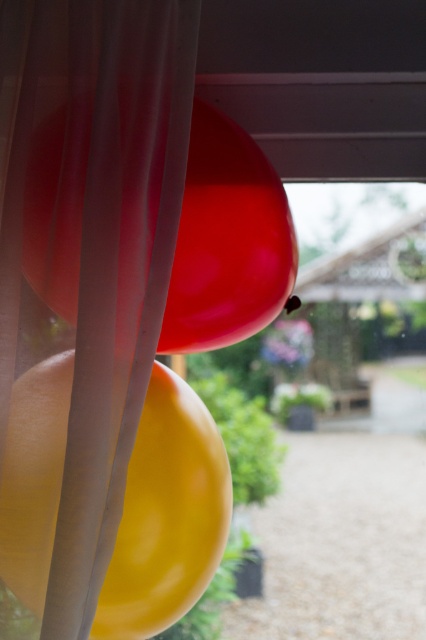
Question: Is translucent sheer curtain at left thinner than glossy rubber balloon at center?

Choices:
 (A) no
 (B) yes

Answer: (B)

Question: Estimate the real-world distances between objects in this image. Which object is farther from the glossy yellow balloon at center?

Choices:
 (A) translucent sheer curtain at left
 (B) glossy rubber balloon at center

Answer: (B)

Question: Which of the following is the closest to the observer?

Choices:
 (A) (77, 342)
 (B) (83, 145)
 (C) (166, 401)

Answer: (A)

Question: Does translucent sheer curtain at left lie behind glossy rubber balloon at center?

Choices:
 (A) no
 (B) yes

Answer: (A)

Question: Can you confirm if translucent sheer curtain at left is positioned below glossy rubber balloon at center?

Choices:
 (A) yes
 (B) no

Answer: (A)

Question: Among these objects, which one is farthest from the camera?

Choices:
 (A) translucent sheer curtain at left
 (B) glossy yellow balloon at center

Answer: (B)